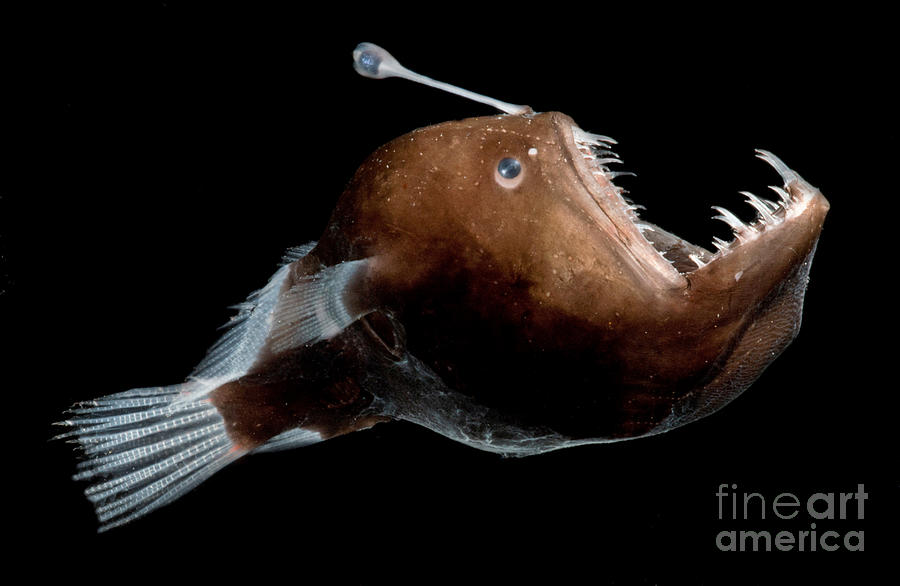
You are a GUI agent. You are given a task and a screenshot of the screen. Output one action in this format:
    pyautogui.click(x=<x>, y=<y>)
    Task: Click on the cord
    Image resolution: width=900 pixels, height=586 pixels.
    Given the screenshot: What is the action you would take?
    pyautogui.click(x=445, y=90)